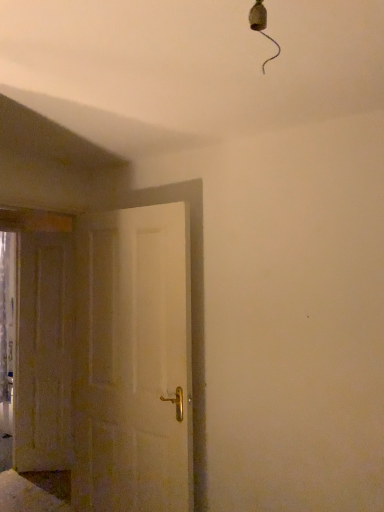
What is the approximate width of white matte door at center, the second door viewed from the back?

It is 6.50 inches.

The image size is (384, 512). What do you see at coordinates (133, 362) in the screenshot?
I see `white matte door at center, the second door when ordered from left to right` at bounding box center [133, 362].

Image resolution: width=384 pixels, height=512 pixels. In order to click on white matte door at center, which is the first door in front-to-back order in this screenshot , I will do `click(133, 362)`.

What do you see at coordinates (43, 352) in the screenshot?
I see `wooden door at left, the second door when ordered from right to left` at bounding box center [43, 352].

Find the location of a particular element. This screenshot has height=512, width=384. wooden door at left, the second door when ordered from right to left is located at coordinates (43, 352).

You are a GUI agent. You are given a task and a screenshot of the screen. Output one action in this format:
    pyautogui.click(x=<x>, y=<y>)
    Task: Click on the white matte door at center, the second door viewed from the back
    The width and height of the screenshot is (384, 512).
    Given the screenshot: What is the action you would take?
    pyautogui.click(x=133, y=362)

Is wooden door at left, the second door when ordered from right to left, to the left of white matte door at center, the second door when ordered from left to right, from the viewer's perspective?

Indeed, wooden door at left, the second door when ordered from right to left, is positioned on the left side of white matte door at center, the second door when ordered from left to right.

Is wooden door at left, the second door when ordered from right to left, positioned behind white matte door at center, which is the first door in front-to-back order?

Yes, wooden door at left, the second door when ordered from right to left, is behind white matte door at center, which is the first door in front-to-back order.

Between point (62, 284) and point (134, 294), which one is positioned in front?

Positioned in front is point (134, 294).

From the image's perspective, is wooden door at left, the second door when ordered from right to left, located beneath white matte door at center, the second door when ordered from left to right?

Yes, from the image's perspective, wooden door at left, the second door when ordered from right to left, is below white matte door at center, the second door when ordered from left to right.

From a real-world perspective, is wooden door at left, the first door when ordered from left to right, over white matte door at center, the second door when ordered from left to right?

No, from a real-world perspective, wooden door at left, the first door when ordered from left to right, is not on top of white matte door at center, the second door when ordered from left to right.

Which object is thinner, wooden door at left, the second door when ordered from right to left, or white matte door at center, the second door viewed from the back?

With smaller width is wooden door at left, the second door when ordered from right to left.

Does wooden door at left, the first door when ordered from left to right, have a lesser height compared to white matte door at center, the second door viewed from the back?

Incorrect, the height of wooden door at left, the first door when ordered from left to right, does not fall short of that of white matte door at center, the second door viewed from the back.

Which of these two, wooden door at left, which appears as the 2th door when viewed from the front, or white matte door at center, the second door when ordered from left to right, is bigger?

white matte door at center, the second door when ordered from left to right.

Looking at this image, is white matte door at center, acting as the 1th door starting from the right, inside wooden door at left, the second door when ordered from right to left?

No, wooden door at left, the second door when ordered from right to left, does not contain white matte door at center, acting as the 1th door starting from the right.

Is there a large distance between wooden door at left, which appears as the first door when viewed from the back, and white matte door at center, acting as the 1th door starting from the right?

Yes, wooden door at left, which appears as the first door when viewed from the back, and white matte door at center, acting as the 1th door starting from the right, are located far from each other.

Is wooden door at left, which appears as the first door when viewed from the back, facing towards white matte door at center, the second door when ordered from left to right?

No, wooden door at left, which appears as the first door when viewed from the back, is not aimed at white matte door at center, the second door when ordered from left to right.

Can you tell me how much wooden door at left, which appears as the 2th door when viewed from the front, and white matte door at center, which is the first door in front-to-back order, differ in facing direction?

There is a 40.5-degree angle between the facing directions of wooden door at left, which appears as the 2th door when viewed from the front, and white matte door at center, which is the first door in front-to-back order.

Identify the location of door lying on the left of white matte door at center, acting as the 1th door starting from the right. The width and height of the screenshot is (384, 512). [x=43, y=352].

Which object is positioned more to the left, white matte door at center, the second door viewed from the back, or wooden door at left, which appears as the 2th door when viewed from the front?

wooden door at left, which appears as the 2th door when viewed from the front, is more to the left.

Is white matte door at center, the second door when ordered from left to right, in front of or behind wooden door at left, which appears as the 2th door when viewed from the front, in the image?

Visually, white matte door at center, the second door when ordered from left to right, is located in front of wooden door at left, which appears as the 2th door when viewed from the front.

Which is nearer, (155, 321) or (59, 395)?

Point (155, 321).

From the image's perspective, who appears lower, white matte door at center, the second door viewed from the back, or wooden door at left, the second door when ordered from right to left?

wooden door at left, the second door when ordered from right to left.

From a real-world perspective, relative to wooden door at left, which appears as the 2th door when viewed from the front, is white matte door at center, the second door viewed from the back, vertically above or below?

Clearly, from a real-world perspective, white matte door at center, the second door viewed from the back, is above wooden door at left, which appears as the 2th door when viewed from the front.

Can you confirm if white matte door at center, the second door viewed from the back, is thinner than wooden door at left, which appears as the first door when viewed from the back?

In fact, white matte door at center, the second door viewed from the back, might be wider than wooden door at left, which appears as the first door when viewed from the back.

Is white matte door at center, which is the first door in front-to-back order, shorter than wooden door at left, the second door when ordered from right to left?

Yes, white matte door at center, which is the first door in front-to-back order, is shorter than wooden door at left, the second door when ordered from right to left.

Does white matte door at center, the second door when ordered from left to right, have a larger size compared to wooden door at left, which appears as the first door when viewed from the back?

Correct, white matte door at center, the second door when ordered from left to right, is larger in size than wooden door at left, which appears as the first door when viewed from the back.

Is white matte door at center, the second door when ordered from left to right, outside of wooden door at left, which appears as the 2th door when viewed from the front?

Yes, white matte door at center, the second door when ordered from left to right, is located beyond the bounds of wooden door at left, which appears as the 2th door when viewed from the front.

Can you see white matte door at center, acting as the 1th door starting from the right, touching wooden door at left, the second door when ordered from right to left?

No.

Based on the photo, is white matte door at center, which is the first door in front-to-back order, looking in the opposite direction of wooden door at left, the second door when ordered from right to left?

That's not correct — white matte door at center, which is the first door in front-to-back order, is not looking away from wooden door at left, the second door when ordered from right to left.

Locate an element on the screen. door below the white matte door at center, acting as the 1th door starting from the right (from a real-world perspective) is located at coordinates (43, 352).

Where is `door behind the white matte door at center, acting as the 1th door starting from the right`? The image size is (384, 512). door behind the white matte door at center, acting as the 1th door starting from the right is located at coordinates (43, 352).

Where is `door that appears on the left of white matte door at center, the second door viewed from the back`? Image resolution: width=384 pixels, height=512 pixels. door that appears on the left of white matte door at center, the second door viewed from the back is located at coordinates (43, 352).